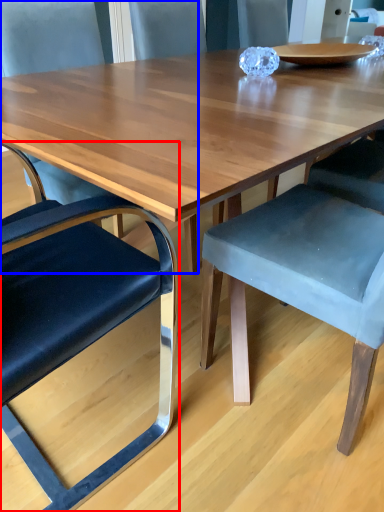
Question: Which object is further to the camera taking this photo, chair (highlighted by a red box) or chair (highlighted by a blue box)?

Choices:
 (A) chair
 (B) chair

Answer: (B)